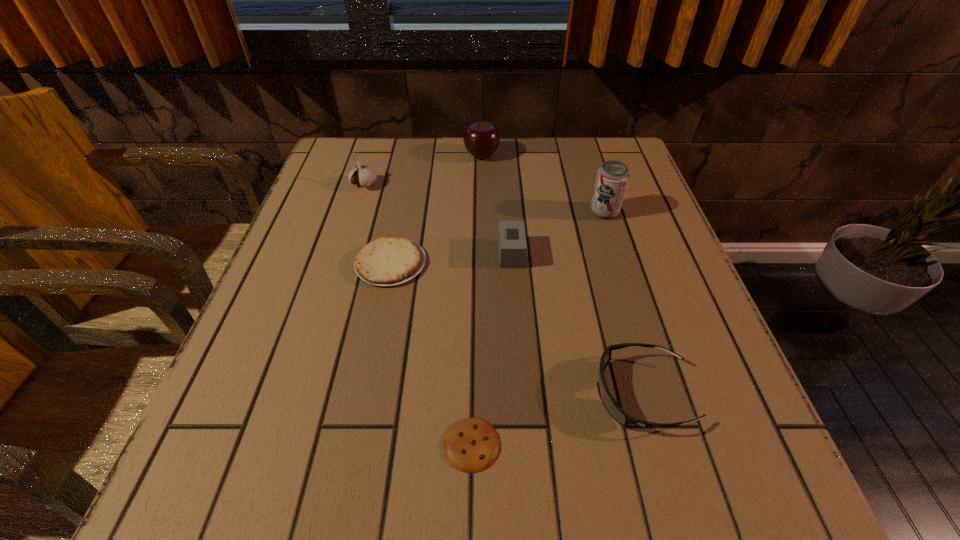
The image size is (960, 540). Identify the location of vacant position located 0.310m on the back of the shortest object. (474, 275).

Where is `apple at the far edge`? Image resolution: width=960 pixels, height=540 pixels. apple at the far edge is located at coordinates (481, 139).

At what (x,y) coordinates should I click in order to perform the action: click on garlic at the far edge. Please return your answer as a coordinate pair (x, y). Image resolution: width=960 pixels, height=540 pixels. Looking at the image, I should click on (364, 176).

Image resolution: width=960 pixels, height=540 pixels. I want to click on object at the near edge, so click(471, 445).

Where is `garlic that is at the left edge`? garlic that is at the left edge is located at coordinates (364, 176).

I want to click on tortilla present at the left edge, so click(391, 260).

You are a GUI agent. You are given a task and a screenshot of the screen. Output one action in this format:
    pyautogui.click(x=<x>, y=<y>)
    Task: Click on the beer can located in the right edge section of the desktop
    
    Given the screenshot: What is the action you would take?
    pyautogui.click(x=612, y=179)

I want to click on goggles present at the right edge, so click(609, 402).

I want to click on object positioned at the far left corner, so click(x=364, y=176).

Locate an element on the screen. The width and height of the screenshot is (960, 540). free space at the far edge of the desktop is located at coordinates (x=489, y=182).